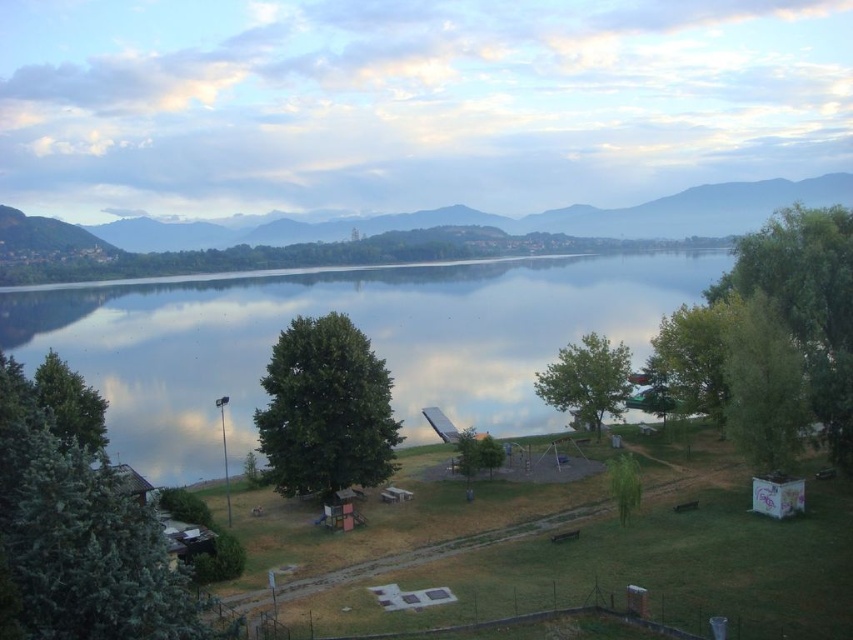
You are standing at the camera position observing the serene lakeside scene. There is a point located at coordinates point (171, 452). Can you reach this point on foot without any obstacles?

The point (171, 452) is 91.57 meters away from the camera position. Since there are no obstacles mentioned in the scene description, you can reach it on foot.

You are standing at the lakeside and want to take a photo of both the glossy reflective water at center and the matte gray mountain at center. Which object will appear larger in the photo?

The glossy reflective water at center will appear larger in the photo because it is closer to the viewer than the matte gray mountain at center.